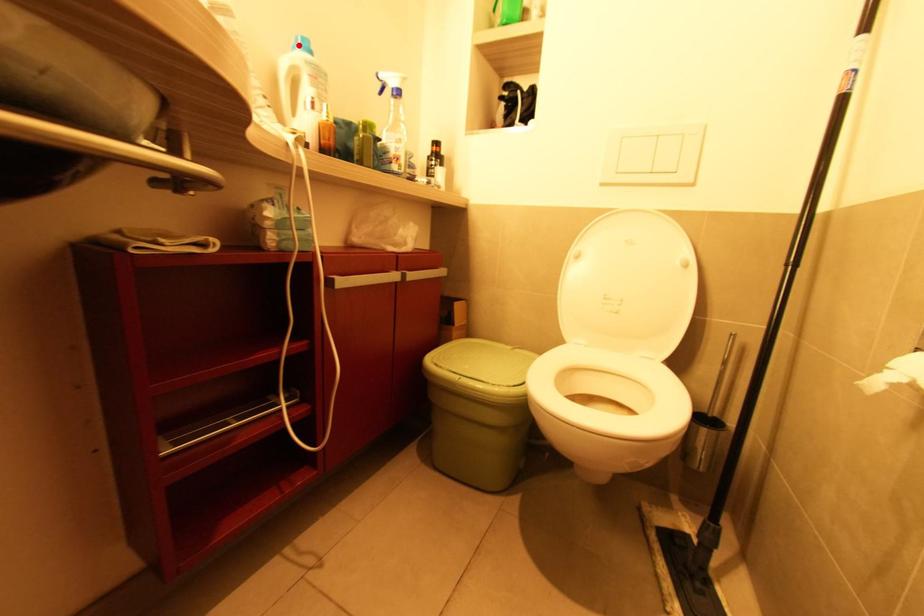
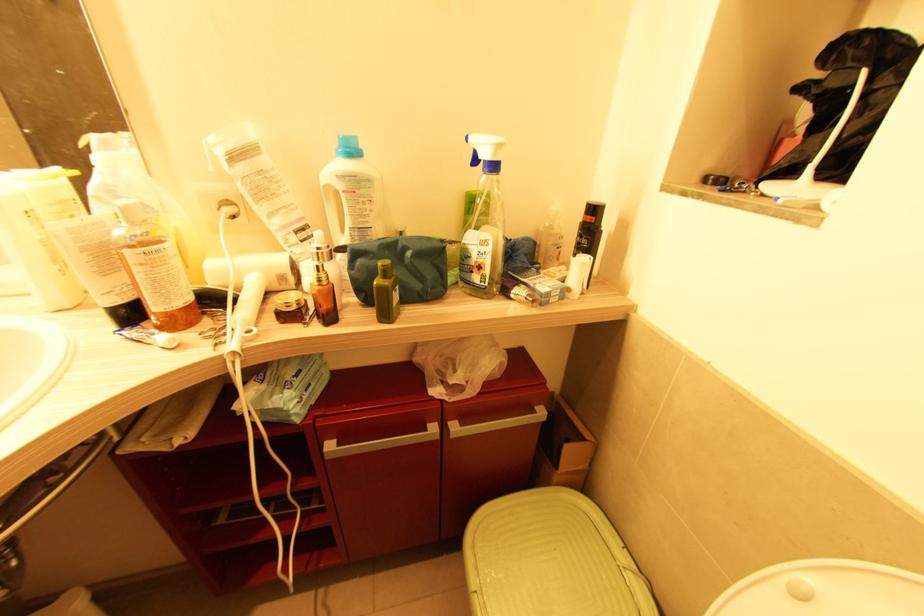
Where in the second image is the point corresponding to the highlighted location from the first image?

(341, 148)